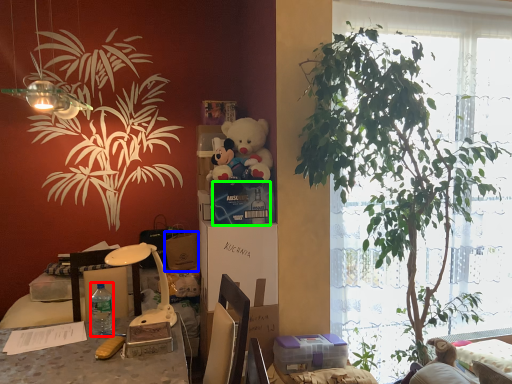
Question: Estimate the real-world distances between objects in this image. Which object is closer to bottle (highlighted by a red box), box (highlighted by a blue box) or box (highlighted by a green box)?

Choices:
 (A) box
 (B) box

Answer: (A)